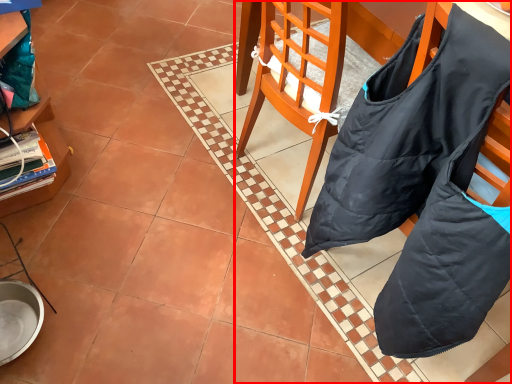
Question: From the image's perspective, where is chair (annotated by the red box) located in relation to cabinetry in the image?

Choices:
 (A) above
 (B) below

Answer: (B)